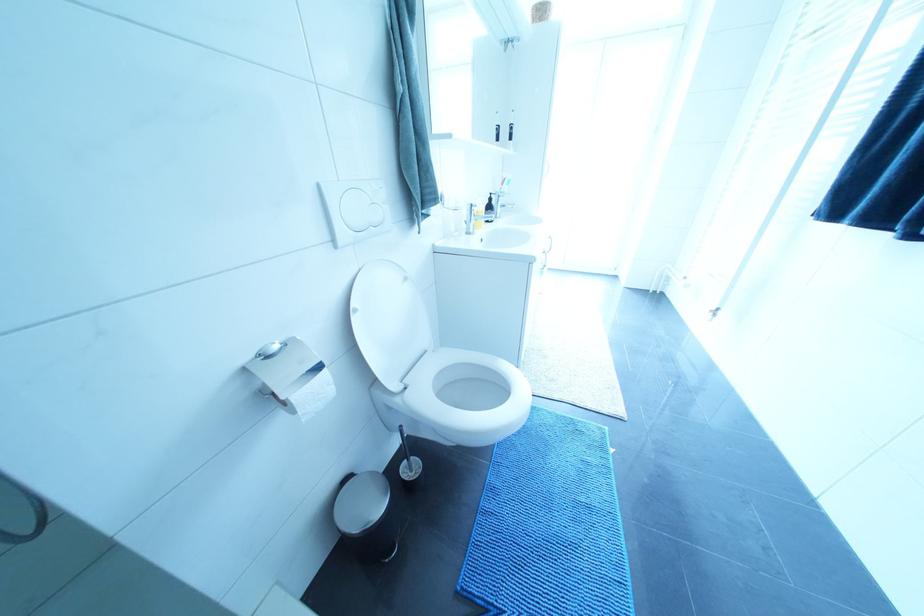
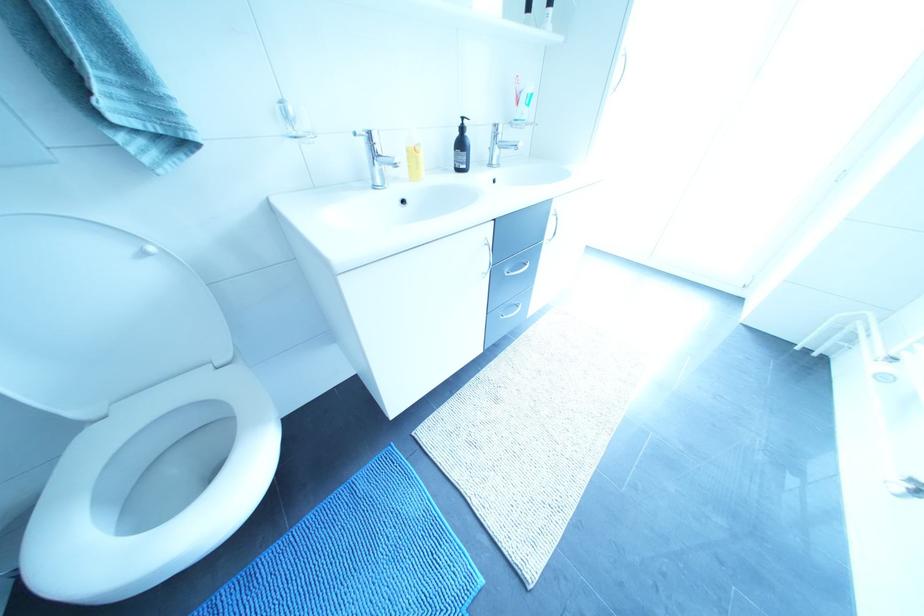
Question: The camera is either moving clockwise (left) or counter-clockwise (right) around the object. The first image is from the beginning of the video and the second image is from the end. Is the camera moving left or right when shooting the video?

Choices:
 (A) Left
 (B) Right

Answer: (B)